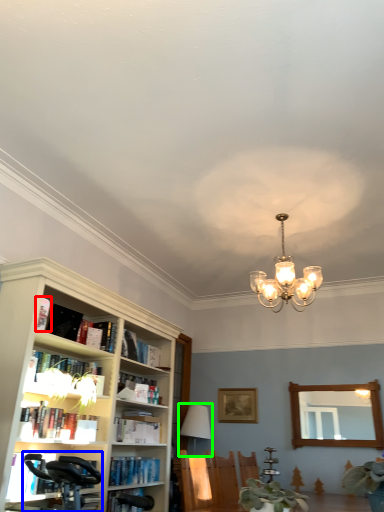
Question: Which is farther away from book (highlighted by a red box)? swivel chair (highlighted by a blue box) or lamp (highlighted by a green box)?

Choices:
 (A) swivel chair
 (B) lamp

Answer: (B)